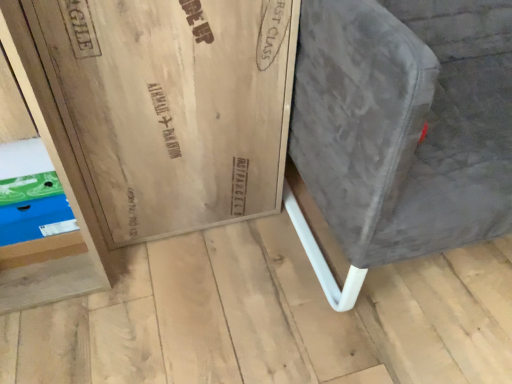
Question: Is blue cardboard shoebox at lower left facing towards velvet grey armchair at right?

Choices:
 (A) no
 (B) yes

Answer: (A)

Question: Are blue cardboard shoebox at lower left and velvet grey armchair at right far apart?

Choices:
 (A) no
 (B) yes

Answer: (A)

Question: Is blue cardboard shoebox at lower left at the right side of velvet grey armchair at right?

Choices:
 (A) yes
 (B) no

Answer: (B)

Question: Can we say blue cardboard shoebox at lower left lies outside velvet grey armchair at right?

Choices:
 (A) no
 (B) yes

Answer: (B)

Question: Could velvet grey armchair at right be considered to be inside blue cardboard shoebox at lower left?

Choices:
 (A) yes
 (B) no

Answer: (B)

Question: Is blue cardboard shoebox at lower left further to the viewer compared to velvet grey armchair at right?

Choices:
 (A) yes
 (B) no

Answer: (A)

Question: Does velvet grey armchair at right lie behind blue cardboard shoebox at lower left?

Choices:
 (A) yes
 (B) no

Answer: (B)

Question: Can you confirm if velvet grey armchair at right is smaller than blue cardboard shoebox at lower left?

Choices:
 (A) yes
 (B) no

Answer: (B)

Question: From a real-world perspective, is velvet grey armchair at right over blue cardboard shoebox at lower left?

Choices:
 (A) yes
 (B) no

Answer: (A)

Question: Can you confirm if velvet grey armchair at right is wider than blue cardboard shoebox at lower left?

Choices:
 (A) no
 (B) yes

Answer: (B)

Question: Is velvet grey armchair at right taller than blue cardboard shoebox at lower left?

Choices:
 (A) yes
 (B) no

Answer: (A)

Question: Does velvet grey armchair at right have a larger size compared to blue cardboard shoebox at lower left?

Choices:
 (A) yes
 (B) no

Answer: (A)

Question: Does point (74, 238) appear closer or farther from the camera than point (402, 139)?

Choices:
 (A) closer
 (B) farther

Answer: (B)